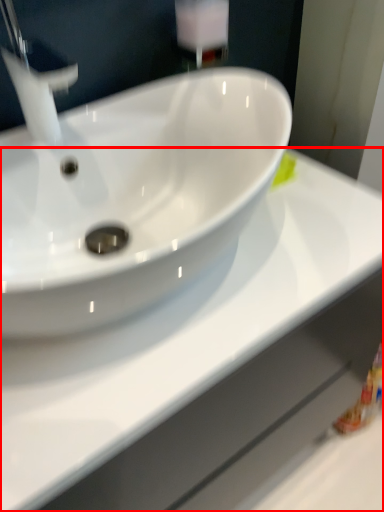
Question: From the image's perspective, where is counter top (annotated by the red box) located relative to tap?

Choices:
 (A) below
 (B) above

Answer: (A)